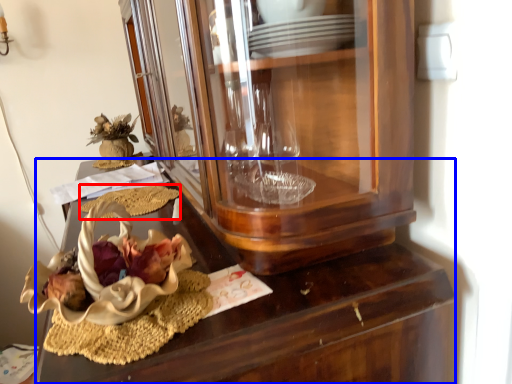
Question: Among these objects, which one is nearest to the camera, food (highlighted by a red box) or desk (highlighted by a blue box)?

Choices:
 (A) food
 (B) desk

Answer: (B)